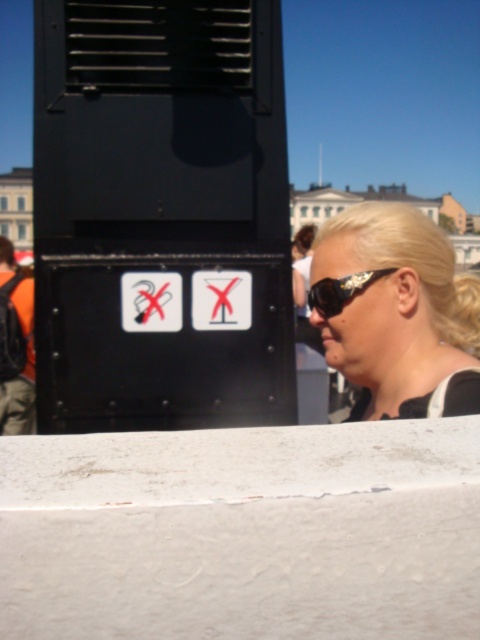
Question: Is white concrete ledge at lower center to the left of gold textured sunglasses at upper right from the viewer's perspective?

Choices:
 (A) yes
 (B) no

Answer: (A)

Question: Can you confirm if blonde hair at upper right is thinner than gold textured sunglasses at upper right?

Choices:
 (A) yes
 (B) no

Answer: (B)

Question: Is white concrete ledge at lower center bigger than gold textured sunglasses at upper right?

Choices:
 (A) yes
 (B) no

Answer: (A)

Question: Estimate the real-world distances between objects in this image. Which object is farther from the gold textured sunglasses at upper right?

Choices:
 (A) blonde hair at upper right
 (B) white concrete ledge at lower center

Answer: (B)

Question: Among these objects, which one is farthest from the camera?

Choices:
 (A) gold textured sunglasses at upper right
 (B) white concrete ledge at lower center

Answer: (A)

Question: Which of the following is the farthest from the observer?

Choices:
 (A) white concrete ledge at lower center
 (B) blonde hair at upper right

Answer: (B)